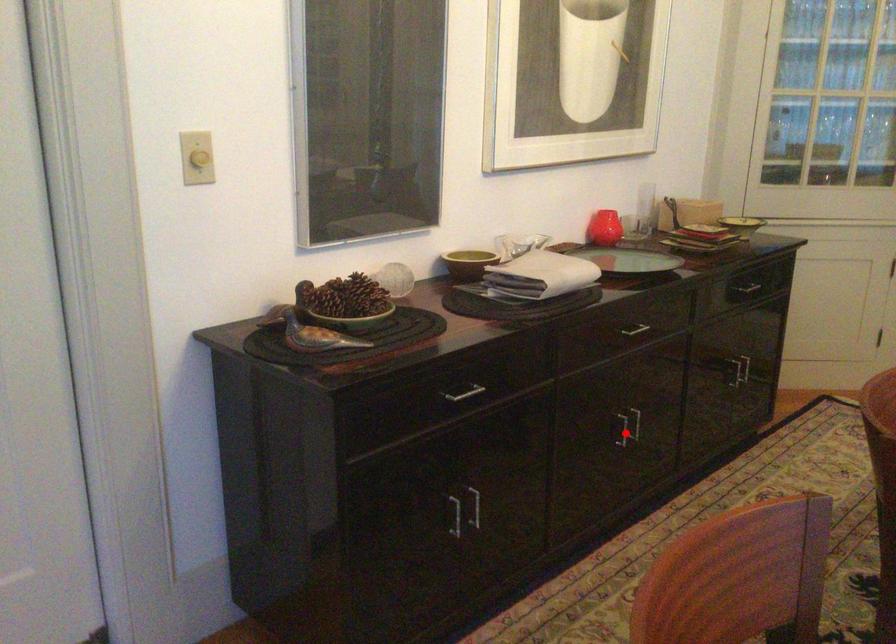
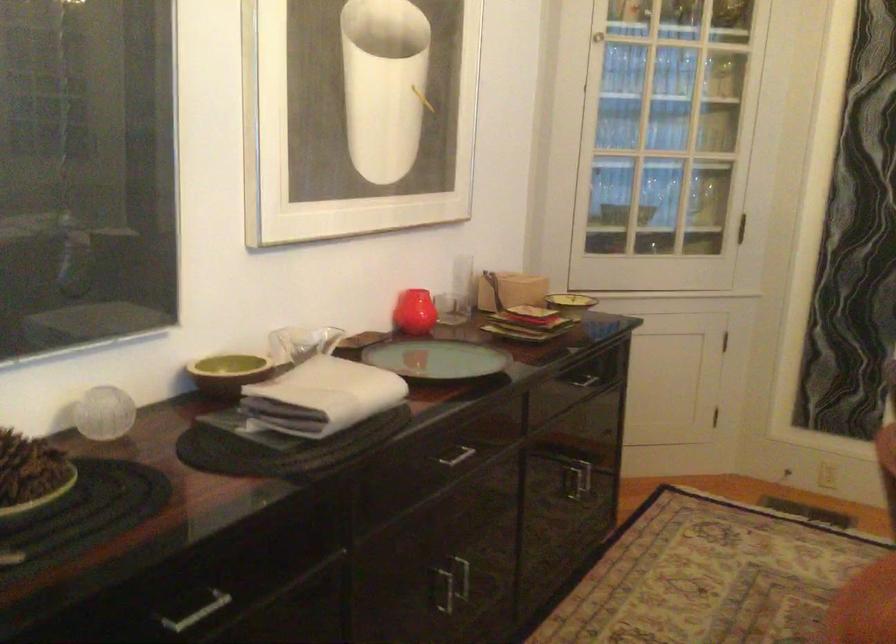
Find the pixel in the second image that matches the highlighted location in the first image.

(443, 589)